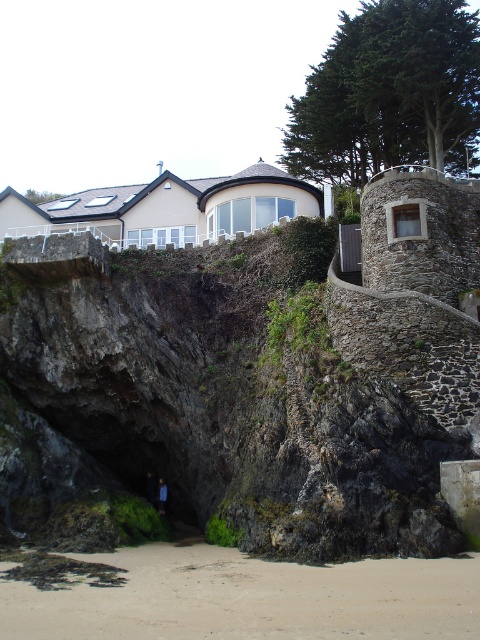
Does light brown sandy beach at lower center appear over blue fabric person at lower center?

Yes.

Is point (297, 637) behind point (165, 496)?

That is False.

Who is more forward, (324, 595) or (160, 493)?

Point (324, 595) is in front.

Identify the location of light brown sandy beach at lower center. click(x=251, y=598).

Who is more forward, (418,352) or (162,481)?

Positioned in front is point (418,352).

This screenshot has width=480, height=640. What do you see at coordinates (262, 372) in the screenshot?
I see `rustic stone castle at center` at bounding box center [262, 372].

This screenshot has width=480, height=640. Identify the location of rustic stone castle at center. (262, 372).

Does rustic stone castle at center come behind light brown sandy beach at lower center?

Yes, rustic stone castle at center is behind light brown sandy beach at lower center.

Does rustic stone castle at center have a lesser height compared to light brown sandy beach at lower center?

No, rustic stone castle at center is not shorter than light brown sandy beach at lower center.

Is point (436, 314) behind point (136, 589)?

Yes, it is.

Find the location of `rustic stone castle at center`. rustic stone castle at center is located at coordinates (262, 372).